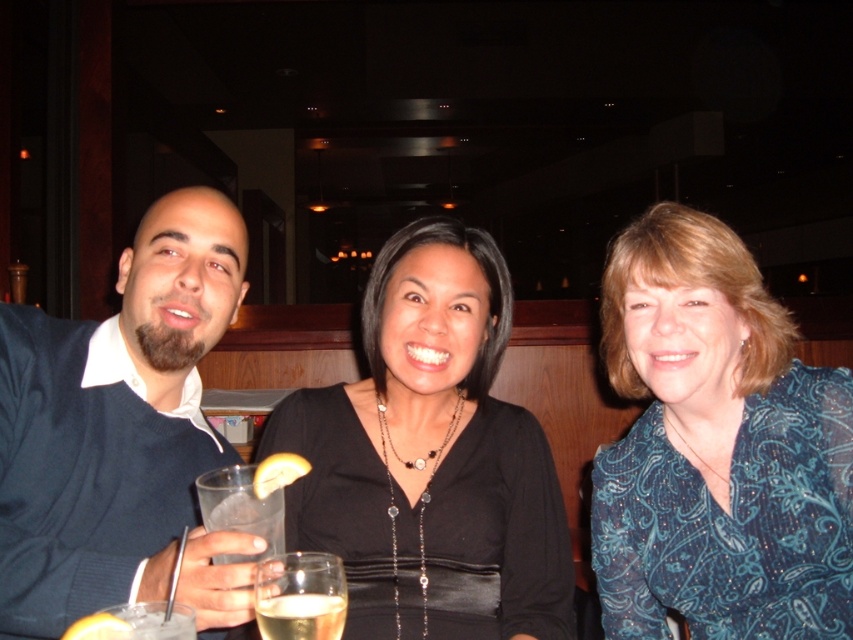
Who is higher up, clear glass at center or yellow citrus peel at lower left?

yellow citrus peel at lower left is above.

Can you confirm if clear glass at center is positioned to the right of yellow citrus peel at lower left?

Correct, you'll find clear glass at center to the right of yellow citrus peel at lower left.

Between point (268, 600) and point (96, 621), which one is positioned in front?

Point (96, 621) is more forward.

What are the coordinates of `clear glass at center` in the screenshot? It's located at (300, 596).

Is point (408, 444) positioned behind point (96, 620)?

Yes, point (408, 444) is behind point (96, 620).

Between black satin dress at center and yellow citrus peel at lower left, which one appears on the left side from the viewer's perspective?

yellow citrus peel at lower left is more to the left.

The height and width of the screenshot is (640, 853). In order to click on black satin dress at center in this screenshot , I will do `click(431, 458)`.

Who is positioned more to the left, clear glass at center or yellow citrus slice at center?

yellow citrus slice at center

Who is positioned more to the right, clear glass at center or yellow citrus slice at center?

clear glass at center is more to the right.

Where is `clear glass at center`? clear glass at center is located at coordinates (300, 596).

You are a GUI agent. You are given a task and a screenshot of the screen. Output one action in this format:
    pyautogui.click(x=<x>, y=<y>)
    Task: Click on the clear glass at center
    Image resolution: width=853 pixels, height=640 pixels.
    Given the screenshot: What is the action you would take?
    pyautogui.click(x=300, y=596)